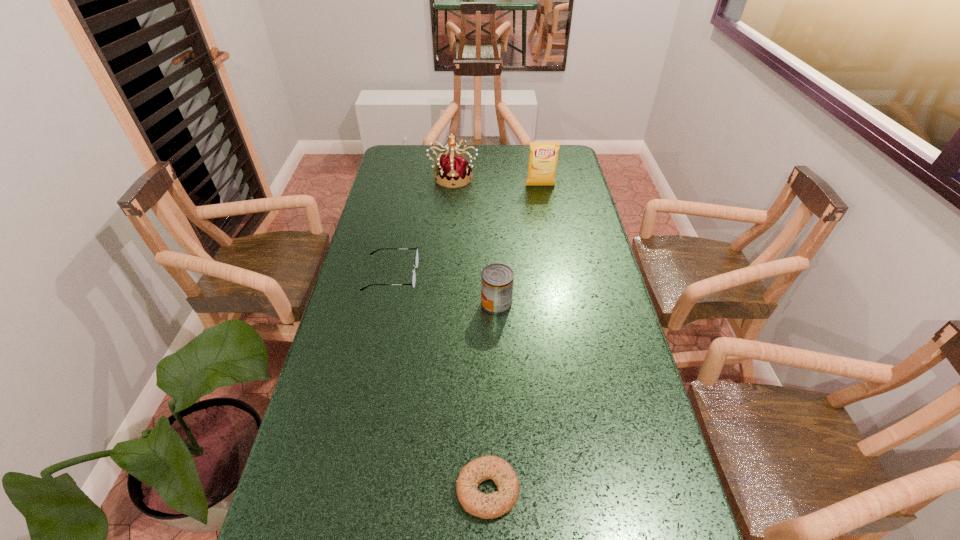
Where is `vacant position in the image that satisfies the following two spatial constraints: 1. on the back side of the third shortest object; 2. on the lenses of the spectacles`? This screenshot has height=540, width=960. vacant position in the image that satisfies the following two spatial constraints: 1. on the back side of the third shortest object; 2. on the lenses of the spectacles is located at coordinates (495, 275).

Where is `vacant region that satisfies the following two spatial constraints: 1. on the front-facing side of the tiara; 2. on the lenses of the spectacles`? The width and height of the screenshot is (960, 540). vacant region that satisfies the following two spatial constraints: 1. on the front-facing side of the tiara; 2. on the lenses of the spectacles is located at coordinates (445, 275).